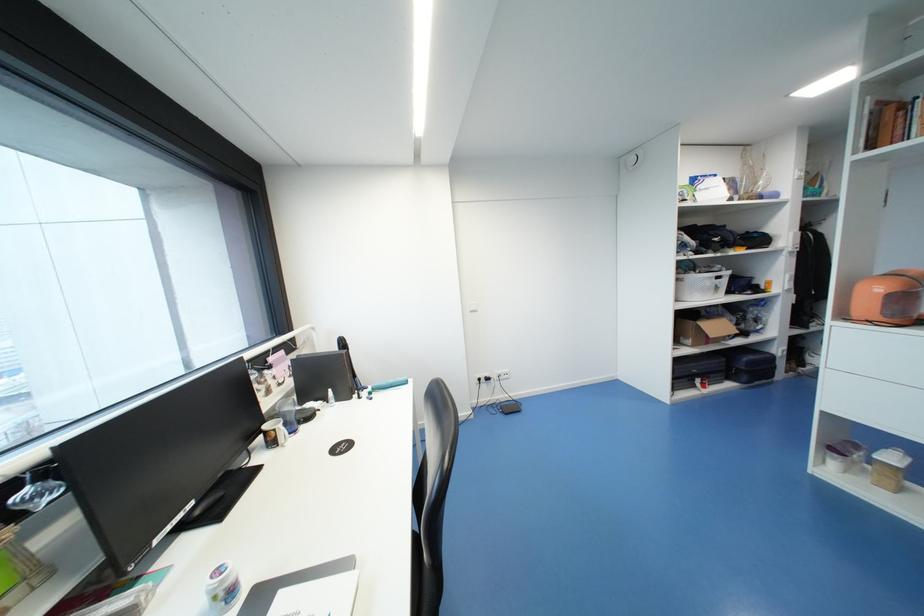
Where is `container with purple lid`? The height and width of the screenshot is (616, 924). container with purple lid is located at coordinates (843, 455).